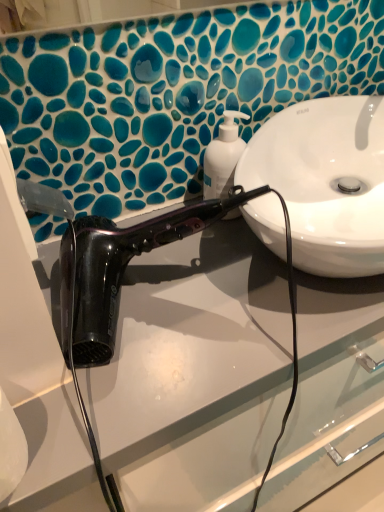
I want to click on white glossy soap dispenser at center, so click(223, 157).

This screenshot has width=384, height=512. What do you see at coordinates (223, 157) in the screenshot?
I see `white glossy soap dispenser at center` at bounding box center [223, 157].

What is the approximate height of white glossy soap dispenser at center?

It is 5.59 inches.

This screenshot has height=512, width=384. What are the coordinates of `shiny black hair dryer at center` in the screenshot? It's located at (117, 270).

This screenshot has width=384, height=512. What do you see at coordinates (117, 270) in the screenshot?
I see `shiny black hair dryer at center` at bounding box center [117, 270].

I want to click on white glossy soap dispenser at center, so click(x=223, y=157).

Which object is positioned more to the left, shiny black hair dryer at center or white glossy soap dispenser at center?

Positioned to the left is shiny black hair dryer at center.

Considering the positions of objects shiny black hair dryer at center and white glossy soap dispenser at center in the image provided, who is behind, shiny black hair dryer at center or white glossy soap dispenser at center?

white glossy soap dispenser at center is further away from the camera.

Is point (147, 244) positioned after point (235, 165)?

No, it is in front of (235, 165).

From the image's perspective, relative to white glossy soap dispenser at center, is shiny black hair dryer at center above or below?

shiny black hair dryer at center is below white glossy soap dispenser at center.

From a real-world perspective, who is located lower, shiny black hair dryer at center or white glossy soap dispenser at center?

From a 3D spatial view, shiny black hair dryer at center is below.

Looking at their sizes, would you say shiny black hair dryer at center is wider or thinner than white glossy soap dispenser at center?

shiny black hair dryer at center is wider than white glossy soap dispenser at center.

Is shiny black hair dryer at center taller than white glossy soap dispenser at center?

Yes.

Considering the sizes of objects shiny black hair dryer at center and white glossy soap dispenser at center in the image provided, who is bigger, shiny black hair dryer at center or white glossy soap dispenser at center?

shiny black hair dryer at center.

Is shiny black hair dryer at center outside of white glossy soap dispenser at center?

Yes, shiny black hair dryer at center is located beyond the bounds of white glossy soap dispenser at center.

Are shiny black hair dryer at center and white glossy soap dispenser at center beside each other?

shiny black hair dryer at center is not next to white glossy soap dispenser at center, and they're not touching.

Does shiny black hair dryer at center turn towards white glossy soap dispenser at center?

No, shiny black hair dryer at center is not oriented towards white glossy soap dispenser at center.

How much distance is there between shiny black hair dryer at center and white glossy soap dispenser at center?

shiny black hair dryer at center and white glossy soap dispenser at center are 7.52 inches apart.

Identify the location of soap dispenser above the shiny black hair dryer at center (from the image's perspective). The height and width of the screenshot is (512, 384). (223, 157).

Is white glossy soap dispenser at center at the left side of shiny black hair dryer at center?

In fact, white glossy soap dispenser at center is to the right of shiny black hair dryer at center.

Considering the relative positions of white glossy soap dispenser at center and shiny black hair dryer at center in the image provided, is white glossy soap dispenser at center behind shiny black hair dryer at center?

That is True.

Is point (222, 154) closer or farther from the camera than point (102, 280)?

Point (222, 154) is farther from the camera than point (102, 280).

From the image's perspective, is white glossy soap dispenser at center above shiny black hair dryer at center?

Yes, from the image's perspective, white glossy soap dispenser at center is above shiny black hair dryer at center.

From a real-world perspective, does white glossy soap dispenser at center stand above shiny black hair dryer at center?

Correct, in the physical world, white glossy soap dispenser at center is higher than shiny black hair dryer at center.

Considering the sizes of objects white glossy soap dispenser at center and shiny black hair dryer at center in the image provided, who is wider, white glossy soap dispenser at center or shiny black hair dryer at center?

Wider between the two is shiny black hair dryer at center.

Considering the sizes of objects white glossy soap dispenser at center and shiny black hair dryer at center in the image provided, who is taller, white glossy soap dispenser at center or shiny black hair dryer at center?

shiny black hair dryer at center.

Does white glossy soap dispenser at center have a larger size compared to shiny black hair dryer at center?

Actually, white glossy soap dispenser at center might be smaller than shiny black hair dryer at center.

Which is correct: white glossy soap dispenser at center is inside shiny black hair dryer at center, or outside of it?

white glossy soap dispenser at center is outside shiny black hair dryer at center.

Is white glossy soap dispenser at center placed right next to shiny black hair dryer at center?

white glossy soap dispenser at center and shiny black hair dryer at center are not in contact.

Is white glossy soap dispenser at center turned away from shiny black hair dryer at center?

That's not correct — white glossy soap dispenser at center is not looking away from shiny black hair dryer at center.

Can you tell me how much white glossy soap dispenser at center and shiny black hair dryer at center differ in facing direction?

0.00115 degrees.

The image size is (384, 512). Find the location of `hair dryer below the white glossy soap dispenser at center (from the image's perspective)`. hair dryer below the white glossy soap dispenser at center (from the image's perspective) is located at coordinates (117, 270).

Where is `soap dispenser above the shiny black hair dryer at center (from a real-world perspective)`? soap dispenser above the shiny black hair dryer at center (from a real-world perspective) is located at coordinates (223, 157).

Locate an element on the screen. This screenshot has width=384, height=512. hair dryer lying in front of the white glossy soap dispenser at center is located at coordinates (117, 270).